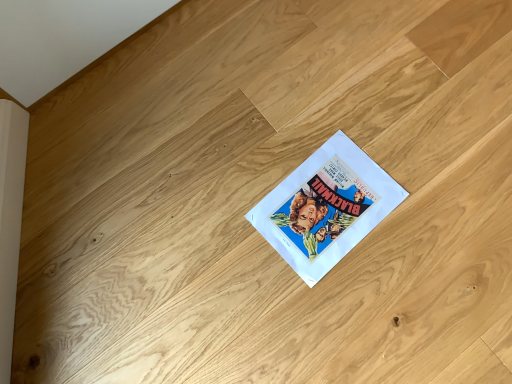
What are the coordinates of `free space above white paper at center (from a real-world perspective)` in the screenshot? It's located at (326, 210).